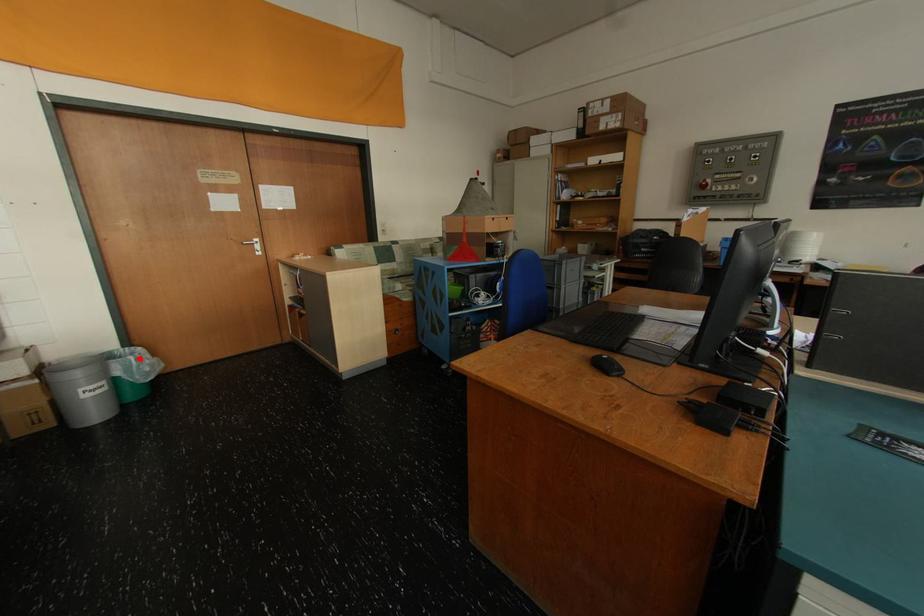
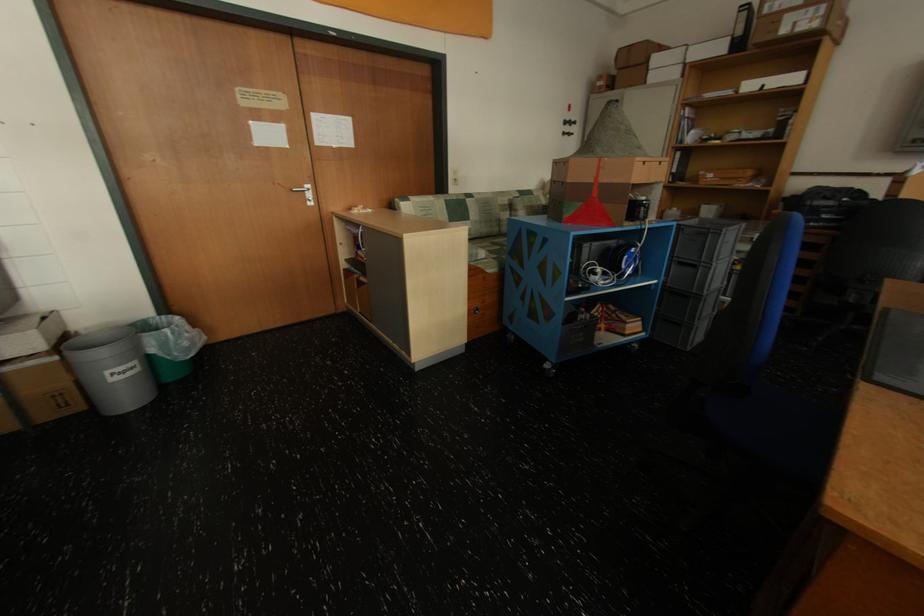
Question: I am providing you with two images of the same scene from different viewpoints. In image1, a red point is highlighted. Considering the same 3D point in image2, which of the following is correct?

Choices:
 (A) It is closer
 (B) It is farther

Answer: (A)